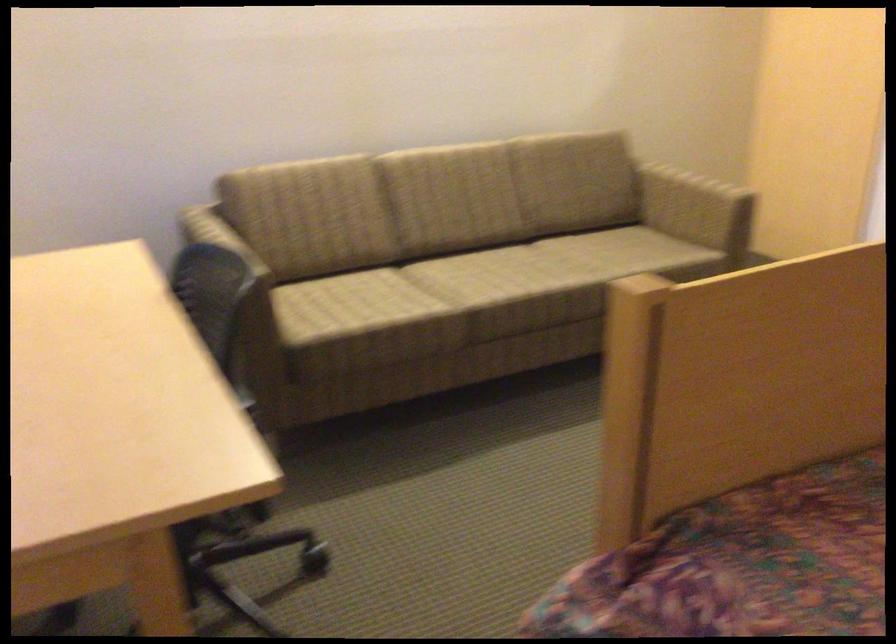
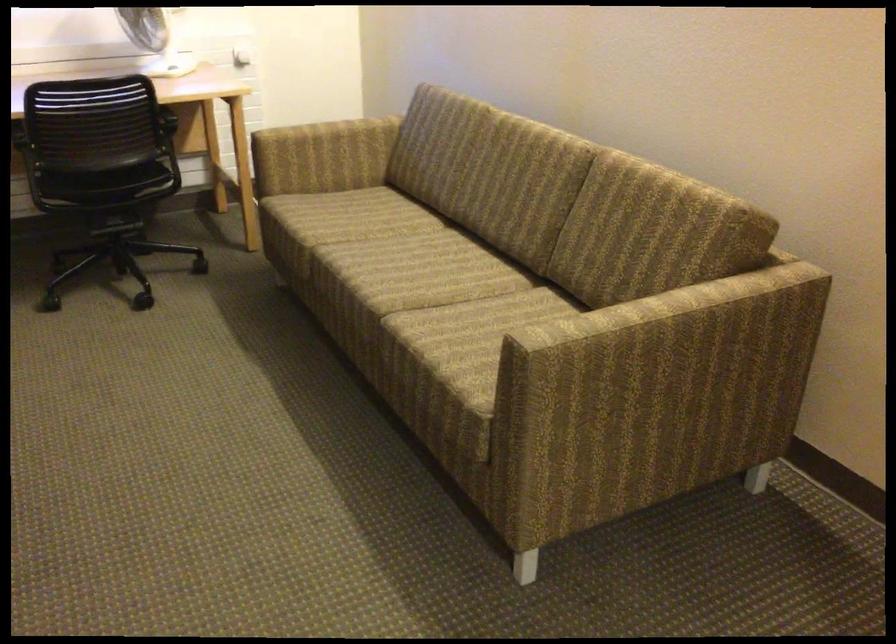
Find the pixel in the second image that matches the point at 561,272 in the first image.

(395, 289)